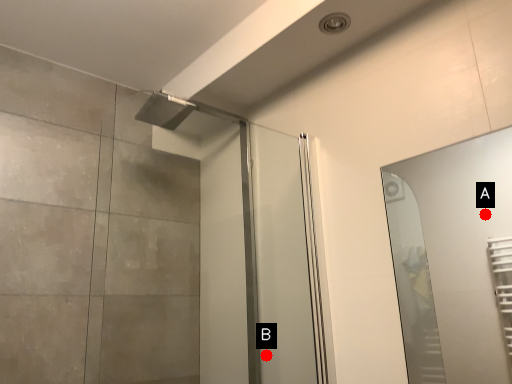
Question: Two points are circled on the image, labeled by A and B beside each circle. Which of the following is the farthest from the observer?

Choices:
 (A) A is further
 (B) B is further

Answer: (A)